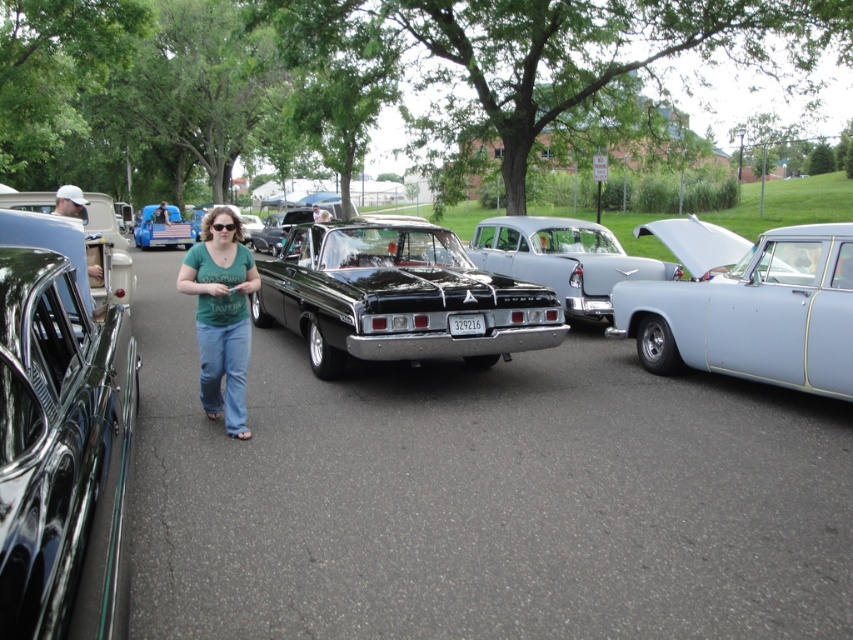
You are standing at the point with coordinates point (x=144, y=224) and want to walk to the point with coordinates point (x=601, y=236). Which direction should you move to reach your destination?

You should move forward because point (x=601, y=236) is in front of point (x=144, y=224).